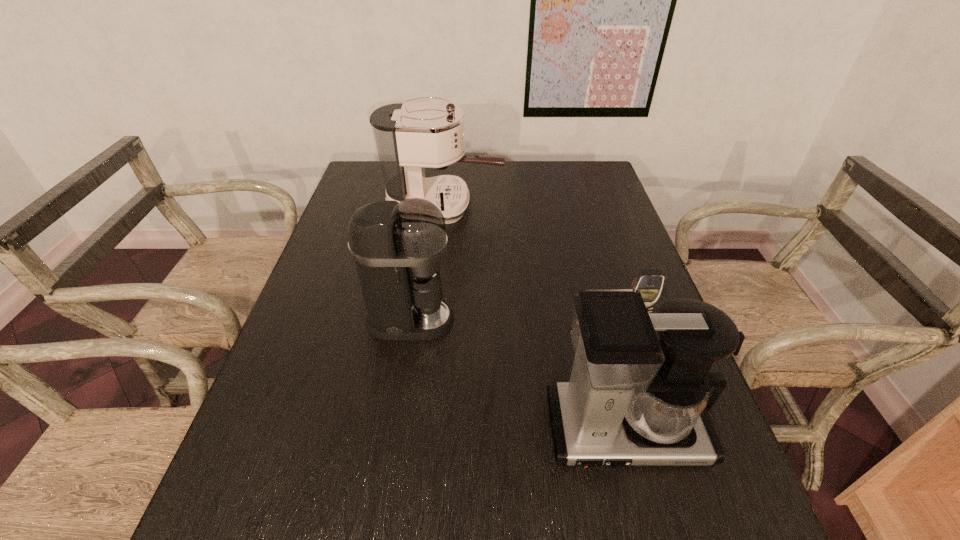
In order to click on the farthest coffee maker in this screenshot , I will do pyautogui.click(x=409, y=136).

Locate an element on the screen. This screenshot has width=960, height=540. the second nearest coffee maker is located at coordinates (398, 247).

Locate an element on the screen. the nearest coffee maker is located at coordinates (632, 399).

You are a GUI agent. You are given a task and a screenshot of the screen. Output one action in this format:
    pyautogui.click(x=<x>, y=<y>)
    Task: Click on the nearest object
    Image resolution: width=960 pixels, height=540 pixels.
    Given the screenshot: What is the action you would take?
    pyautogui.click(x=632, y=399)

Identify the location of cellular telephone. This screenshot has height=540, width=960. (649, 282).

At what (x,y) coordinates should I click in order to perform the action: click on free spot located 0.120m on the front-facing side of the farthest object. Please return your answer as a coordinate pair (x, y). The width and height of the screenshot is (960, 540). Looking at the image, I should click on (540, 206).

Locate an element on the screen. This screenshot has width=960, height=540. free spot located place cup under the spout of the second farthest coffee maker is located at coordinates (528, 320).

What are the coordinates of `vacant region located at the front of the nearest coffee maker where the controls are located` in the screenshot? It's located at (652, 531).

Locate an element on the screen. The image size is (960, 540). vacant space located 0.370m on the front face of the shortest object is located at coordinates (693, 479).

In order to click on object that is at the far edge in this screenshot , I will do `click(409, 136)`.